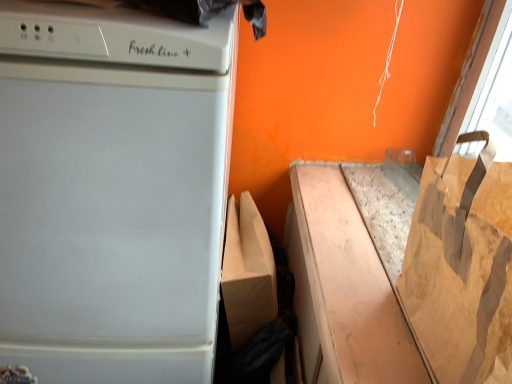
Question: Would you say white glossy dishwasher at left is part of brown paper bag at right's contents?

Choices:
 (A) yes
 (B) no

Answer: (B)

Question: Is brown paper bag at right taller than white glossy dishwasher at left?

Choices:
 (A) yes
 (B) no

Answer: (B)

Question: Is brown paper bag at right aimed at white glossy dishwasher at left?

Choices:
 (A) yes
 (B) no

Answer: (A)

Question: From a real-world perspective, is brown paper bag at right positioned under white glossy dishwasher at left based on gravity?

Choices:
 (A) yes
 (B) no

Answer: (B)

Question: Is brown paper bag at right positioned in front of white glossy dishwasher at left?

Choices:
 (A) no
 (B) yes

Answer: (B)

Question: Is brown paper bag at right looking in the opposite direction of white glossy dishwasher at left?

Choices:
 (A) yes
 (B) no

Answer: (B)

Question: From the image's perspective, is white glossy dishwasher at left located beneath brown paper bag at right?

Choices:
 (A) no
 (B) yes

Answer: (B)

Question: Can you confirm if white glossy dishwasher at left is bigger than brown paper bag at right?

Choices:
 (A) yes
 (B) no

Answer: (A)

Question: Does white glossy dishwasher at left have a lesser width compared to brown paper bag at right?

Choices:
 (A) no
 (B) yes

Answer: (A)

Question: Is white glossy dishwasher at left facing towards brown paper bag at right?

Choices:
 (A) yes
 (B) no

Answer: (B)

Question: Is brown paper bag at right a part of white glossy dishwasher at left?

Choices:
 (A) no
 (B) yes

Answer: (A)

Question: Can you confirm if white glossy dishwasher at left is positioned to the right of brown paper bag at right?

Choices:
 (A) yes
 (B) no

Answer: (B)

Question: Can you confirm if brown paper bag at lower right is thinner than white glossy dishwasher at left?

Choices:
 (A) no
 (B) yes

Answer: (B)